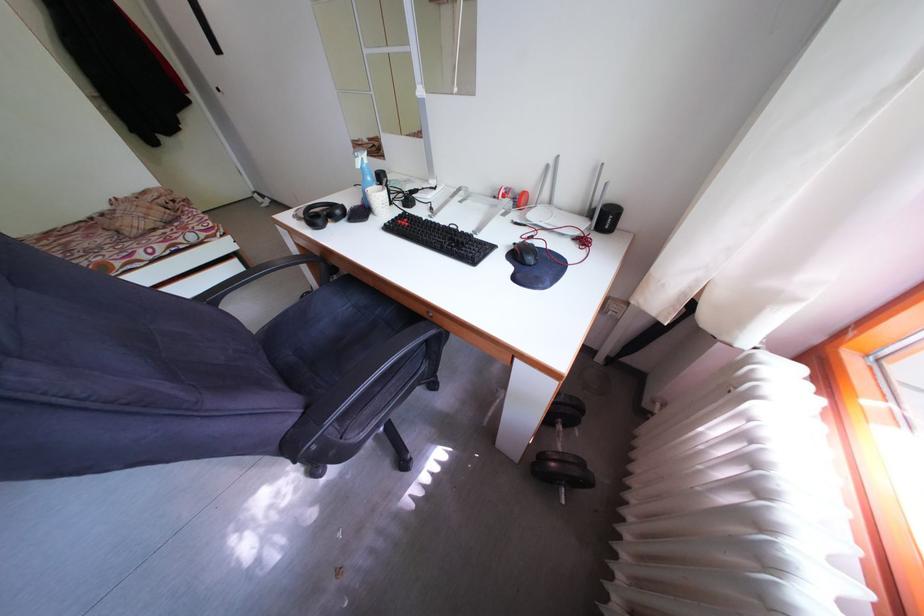
This screenshot has width=924, height=616. Describe the element at coordinates (363, 171) in the screenshot. I see `the blue spray bottle` at that location.